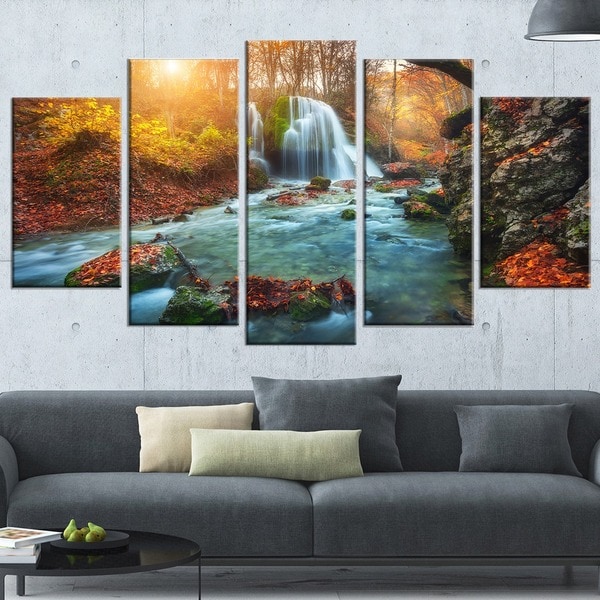
The image size is (600, 600). Identify the location of yellow pillow. point(170,445).